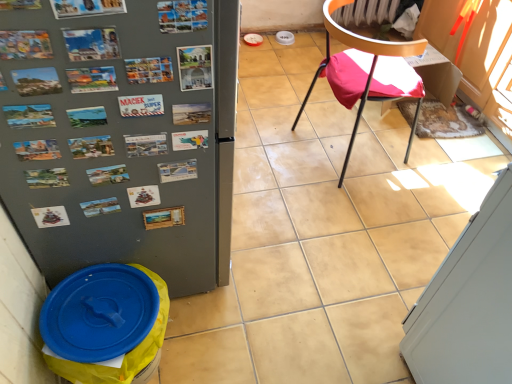
The width and height of the screenshot is (512, 384). What do you see at coordinates (367, 67) in the screenshot? I see `metallic black chair at center right` at bounding box center [367, 67].

Where is `metallic gray refrigerator at left`? This screenshot has height=384, width=512. metallic gray refrigerator at left is located at coordinates (119, 137).

What do you see at coordinates (119, 137) in the screenshot?
I see `metallic gray refrigerator at left` at bounding box center [119, 137].

Locate an element on the screen. The width and height of the screenshot is (512, 384). metallic black chair at center right is located at coordinates (367, 67).

Between metallic gray refrigerator at left and metallic postcards at upper center, which one appears on the right side from the viewer's perspective?

Positioned to the right is metallic postcards at upper center.

What's the angular difference between metallic gray refrigerator at left and metallic postcards at upper center's facing directions?

They differ by 91.9 degrees in their facing directions.

Is point (219, 105) positioned after point (163, 12)?

Yes, it is.

From the image's perspective, is metallic gray refrigerator at left above or below metallic postcards at upper center?

metallic gray refrigerator at left is below metallic postcards at upper center.

At what (x,y) coordinates should I click in order to perform the action: click on screen door on the right of metallic postcards at upper center. Please return your answer as a coordinate pair (x, y). This screenshot has height=384, width=512. Looking at the image, I should click on (468, 302).

Which is more distant, [160,27] or [510,184]?

The point [510,184] is farther.

How different are the orientations of metallic postcards at upper center and white glossy screen door at lower right in degrees?

They differ by 177 degrees in their facing directions.

Are metallic black chair at center right and blue plastic lid at lower left located far from each other?

Yes, metallic black chair at center right and blue plastic lid at lower left are located far from each other.

Identify the location of chair that is above the blue plastic lid at lower left (from the image's perspective). Image resolution: width=512 pixels, height=384 pixels. (367, 67).

Does metallic black chair at center right have a larger size compared to blue plastic lid at lower left?

Yes, metallic black chair at center right is bigger than blue plastic lid at lower left.

Consider the image. What's the angular difference between white glossy screen door at lower right and metallic postcards at upper center's facing directions?

There is a 177-degree angle between the facing directions of white glossy screen door at lower right and metallic postcards at upper center.

From a real-world perspective, is white glossy screen door at lower right on metallic postcards at upper center?

Actually, white glossy screen door at lower right is physically below metallic postcards at upper center in the real world.

Would you say white glossy screen door at lower right is a long distance from metallic postcards at upper center?

No.

From the image's perspective, which object appears higher, white glossy screen door at lower right or metallic gray refrigerator at left?

metallic gray refrigerator at left is shown above in the image.

Considering the positions of points (422, 303) and (102, 34), is point (422, 303) closer to camera compared to point (102, 34)?

No, it is not.

Is metallic gray refrigerator at left at the back of white glossy screen door at lower right?

That's not correct — white glossy screen door at lower right is not looking away from metallic gray refrigerator at left.

Considering the sizes of white glossy screen door at lower right and metallic gray refrigerator at left in the image, is white glossy screen door at lower right taller or shorter than metallic gray refrigerator at left?

Clearly, white glossy screen door at lower right is shorter compared to metallic gray refrigerator at left.

Can you confirm if metallic gray refrigerator at left is positioned to the left of metallic black chair at center right?

Yes.

This screenshot has width=512, height=384. In order to click on chair behind the metallic gray refrigerator at left in this screenshot , I will do `click(367, 67)`.

Based on the photo, from their relative heights in the image, would you say metallic gray refrigerator at left is taller or shorter than metallic black chair at center right?

In the image, metallic gray refrigerator at left appears to be taller than metallic black chair at center right.

Is there a large distance between blue plastic lid at lower left and white glossy screen door at lower right?

No, there isn't a large distance between blue plastic lid at lower left and white glossy screen door at lower right.

Visually, is blue plastic lid at lower left positioned to the left or to the right of white glossy screen door at lower right?

Clearly, blue plastic lid at lower left is on the left of white glossy screen door at lower right in the image.

Consider the image. From the image's perspective, which is below, blue plastic lid at lower left or white glossy screen door at lower right?

blue plastic lid at lower left appears lower in the image.

From a real-world perspective, is blue plastic lid at lower left positioned above or below white glossy screen door at lower right?

From a real-world perspective, blue plastic lid at lower left is physically below white glossy screen door at lower right.

Find the location of a particular element. The image size is (512, 384). refrigerator lying on the left of metallic postcards at upper center is located at coordinates (119, 137).

At what (x,y) coordinates should I click in order to perform the action: click on poster above the white glossy screen door at lower right (from the image's perspective). Please return your answer as a coordinate pair (x, y). The width and height of the screenshot is (512, 384). Looking at the image, I should click on (182, 16).

When comparing their distances from metallic gray refrigerator at left, does metallic postcards at upper center or white glossy screen door at lower right seem further?

white glossy screen door at lower right is positioned further to the anchor metallic gray refrigerator at left.

Estimate the real-world distances between objects in this image. Which object is further from white glossy screen door at lower right, blue plastic lid at lower left or metallic postcards at upper center?

The object further to white glossy screen door at lower right is metallic postcards at upper center.

Based on their spatial positions, is metallic gray refrigerator at left or white glossy screen door at lower right closer to metallic postcards at upper center?

metallic gray refrigerator at left is closer to metallic postcards at upper center.

Based on their spatial positions, is blue plastic lid at lower left or metallic postcards at upper center further from metallic black chair at center right?

blue plastic lid at lower left is further to metallic black chair at center right.

Based on the photo, based on their spatial positions, is white glossy screen door at lower right or metallic black chair at center right closer to metallic postcards at upper center?

Based on the image, white glossy screen door at lower right appears to be nearer to metallic postcards at upper center.

When comparing their distances from metallic postcards at upper center, does white glossy screen door at lower right or blue plastic lid at lower left seem closer?

blue plastic lid at lower left is closer to metallic postcards at upper center.

Considering their positions, is metallic black chair at center right positioned further to metallic postcards at upper center than white glossy screen door at lower right?

Based on the image, metallic black chair at center right appears to be further to metallic postcards at upper center.

When comparing their distances from metallic gray refrigerator at left, does white glossy screen door at lower right or metallic black chair at center right seem closer?

white glossy screen door at lower right is positioned closer to the anchor metallic gray refrigerator at left.

Locate an element on the screen. Image resolution: width=512 pixels, height=384 pixels. refrigerator situated between blue plastic lid at lower left and white glossy screen door at lower right from left to right is located at coordinates (x=119, y=137).

Find the location of a particular element. refrigerator located between blue plastic lid at lower left and metallic black chair at center right in the left-right direction is located at coordinates (119, 137).

Where is `poster located between blue plastic lid at lower left and white glossy screen door at lower right in the left-right direction`? This screenshot has height=384, width=512. poster located between blue plastic lid at lower left and white glossy screen door at lower right in the left-right direction is located at coordinates (182, 16).

What are the coordinates of `refrigerator between metallic postcards at upper center and blue plastic lid at lower left vertically` in the screenshot? It's located at (119, 137).